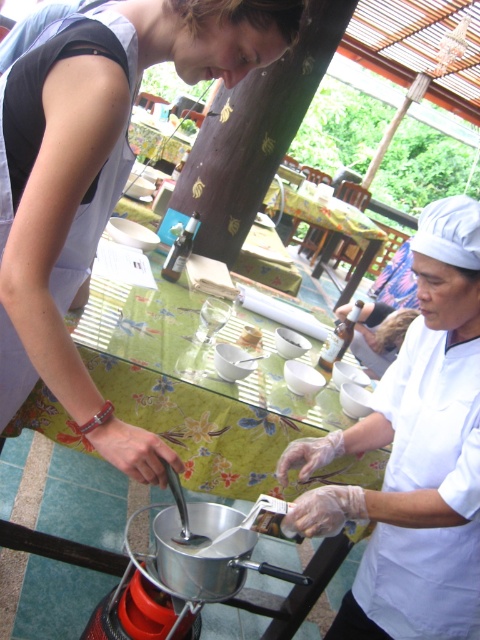
Question: Does matte white chef hat at upper right appear on the right side of white glossy chef hat at upper right?

Choices:
 (A) no
 (B) yes

Answer: (A)

Question: Among these points, which one is farthest from the camera?

Choices:
 (A) [75, 168]
 (B) [249, 344]

Answer: (B)

Question: Which object is closer to the camera taking this photo?

Choices:
 (A) matte white chef hat at upper right
 (B) white matte bowl at center
 (C) white glossy chef hat at upper right

Answer: (A)

Question: Does white glossy chef hat at upper right have a larger size compared to white matte bowl at center?

Choices:
 (A) no
 (B) yes

Answer: (B)

Question: Can you confirm if matte white chef hat at upper right is positioned below white matte bowl at center?

Choices:
 (A) yes
 (B) no

Answer: (B)

Question: Among these objects, which one is nearest to the camera?

Choices:
 (A) matte white chef hat at upper right
 (B) white glossy chef hat at upper right
 (C) white matte bowl at center

Answer: (A)